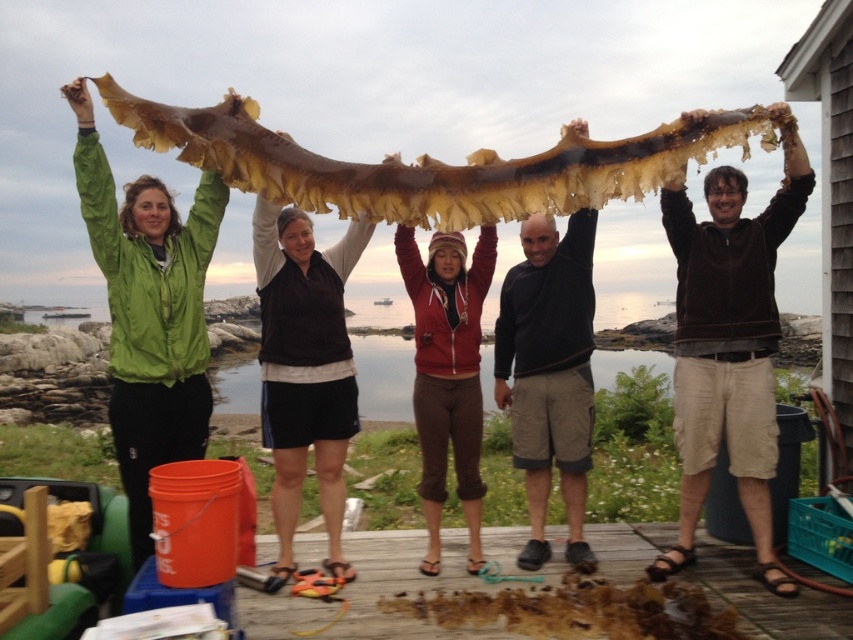
Can you confirm if matte brown hair at center is positioned to the left of smooth brown hair at center?

Indeed, matte brown hair at center is positioned on the left side of smooth brown hair at center.

Does matte brown hair at center have a greater height compared to smooth brown hair at center?

Indeed, matte brown hair at center has a greater height compared to smooth brown hair at center.

Image resolution: width=853 pixels, height=640 pixels. I want to click on matte brown hair at center, so click(294, 236).

Does matte brown hair at center have a lesser height compared to matte green jacket at upper left?

Yes, matte brown hair at center is shorter than matte green jacket at upper left.

Does matte brown hair at center appear under matte green jacket at upper left?

Yes.

Is point (302, 221) farther from camera compared to point (119, 211)?

Yes, point (302, 221) is behind point (119, 211).

At what (x,y) coordinates should I click in order to perform the action: click on matte brown hair at center. Please return your answer as a coordinate pair (x, y). Looking at the image, I should click on [294, 236].

Can you confirm if dark gray sweater at center is smaller than knitted wool hat at center?

No.

Which is in front, point (529, 477) or point (454, 230)?

Point (454, 230) is in front.

This screenshot has height=640, width=853. I want to click on dark gray sweater at center, so click(549, 372).